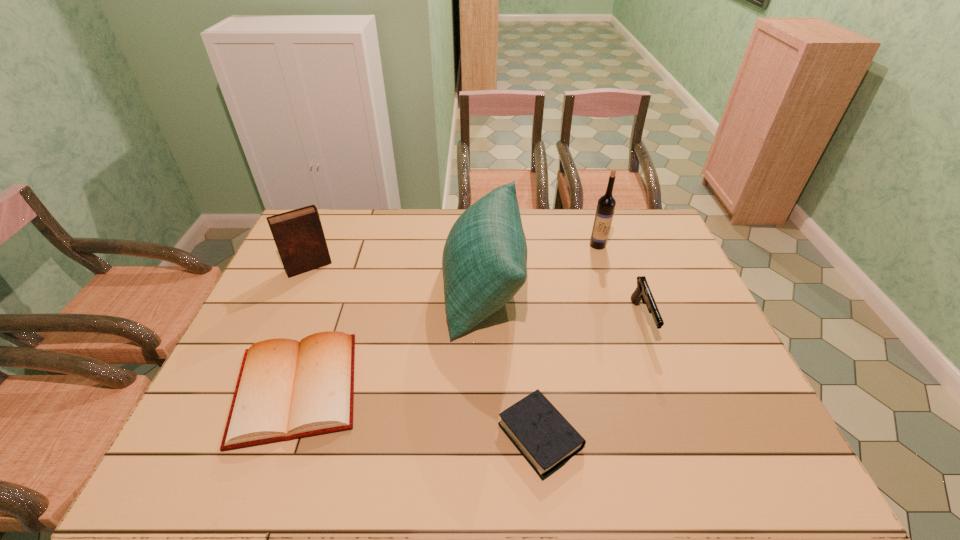
At what (x,y) coordinates should I click in order to perform the action: click on free space located 0.350m on the front-facing side of the cushion. Please return your answer as a coordinate pair (x, y). The height and width of the screenshot is (540, 960). Looking at the image, I should click on (334, 287).

At what (x,y) coordinates should I click in order to perform the action: click on free space located on the right of the fourth shortest object. Please return your answer as a coordinate pair (x, y). Looking at the image, I should click on (448, 267).

Find the location of a particular element. The width and height of the screenshot is (960, 540). vacant space positioned at the aiming end of the fourth tallest object is located at coordinates (660, 371).

Identify the location of free region located on the back of the rightmost Bible. (525, 296).

You are a GUI agent. You are given a task and a screenshot of the screen. Output one action in this format:
    pyautogui.click(x=<x>, y=<y>)
    Task: Click on the wine bottle located in the far edge section of the desktop
    The height and width of the screenshot is (540, 960).
    Given the screenshot: What is the action you would take?
    pyautogui.click(x=606, y=204)

In order to click on cushion located in the far edge section of the desktop in this screenshot , I will do `click(484, 262)`.

Identify the location of object positioned at the near left corner. This screenshot has height=540, width=960. (286, 389).

The width and height of the screenshot is (960, 540). I want to click on free space at the far edge of the desktop, so point(538,216).

In order to click on free space at the near edge in this screenshot , I will do `click(564, 467)`.

Identify the location of vacant region at the left edge. The width and height of the screenshot is (960, 540). (197, 438).